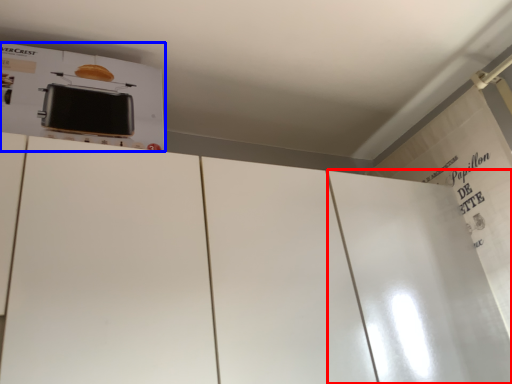
Question: Which object is further to the camera taking this photo, door (highlighted by a red box) or appliance (highlighted by a blue box)?

Choices:
 (A) door
 (B) appliance

Answer: (A)